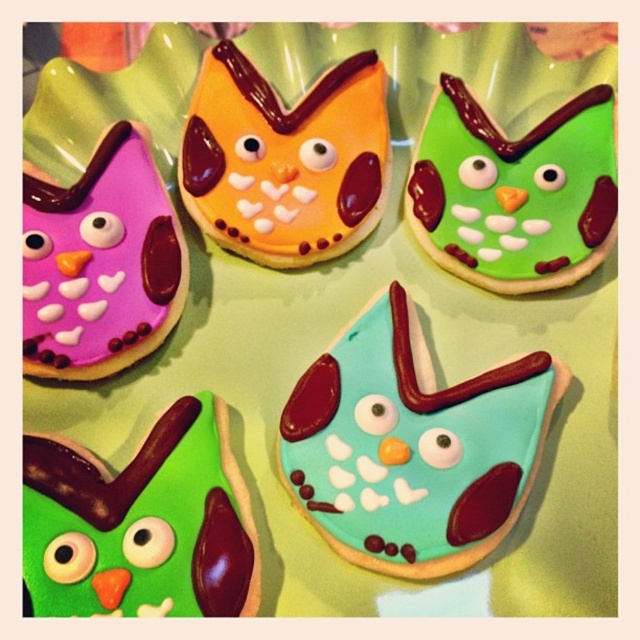
Please provide the exact coordinates of the teal glossy cookie at center in the image.

The teal glossy cookie at center is located at coordinates point (412, 445).